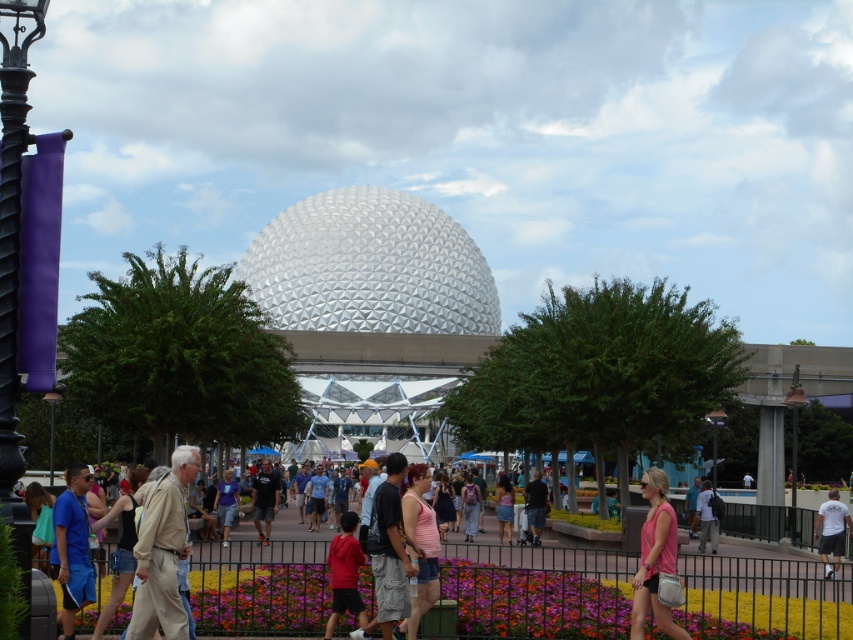
You are a photographer at the theme park and want to capture both the metallic silver sphere at center and the pink fabric dress at center in a single frame. Based on their sizes, which object should you focus on to ensure both are clearly visible without zooming in or out?

The metallic silver sphere at center is wider than the pink fabric dress at center, so you should focus on the metallic silver sphere at center to ensure both objects are clearly visible in the frame.

You are a photographer standing in the theme park and want to capture both the metallic silver sphere at center and the pink fabric dress at center in the same frame. Which object should you focus on first to ensure both are in the frame?

You should focus on the metallic silver sphere at center first because it is taller than the pink fabric dress at center, so adjusting the frame to include its height will naturally include the shorter dress as well.